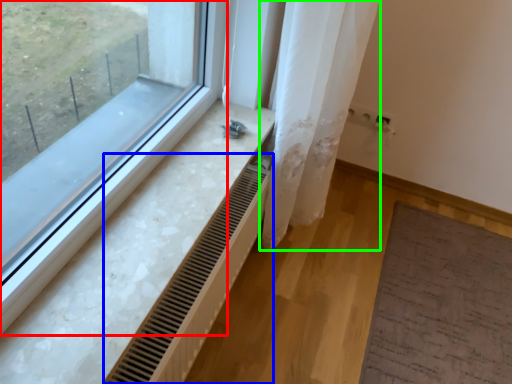
Question: Based on their relative distances, which object is farther from window (highlighted by a red box)? Choose from radiator (highlighted by a blue box) and shower curtain (highlighted by a green box).

Choices:
 (A) radiator
 (B) shower curtain

Answer: (B)